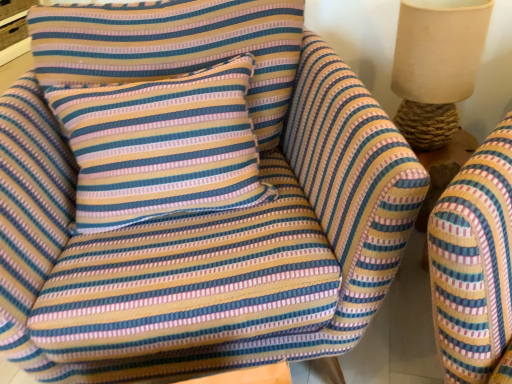
Where is `striped fabric pillow at center`? This screenshot has width=512, height=384. striped fabric pillow at center is located at coordinates (162, 147).

Image resolution: width=512 pixels, height=384 pixels. What do you see at coordinates (162, 147) in the screenshot?
I see `striped fabric pillow at center` at bounding box center [162, 147].

What do you see at coordinates (436, 66) in the screenshot?
I see `burlap lampshade at upper right` at bounding box center [436, 66].

Where is `burlap lampshade at upper right`? The width and height of the screenshot is (512, 384). burlap lampshade at upper right is located at coordinates (436, 66).

At what (x,y) coordinates should I click in order to perform the action: click on striped fabric pillow at center. Please return your answer as a coordinate pair (x, y). The image size is (512, 384). Looking at the image, I should click on (162, 147).

Looking at this image, in the image, is striped fabric pillow at center on the left side or the right side of burlap lampshade at upper right?

striped fabric pillow at center is positioned on burlap lampshade at upper right's left side.

Is the depth of striped fabric pillow at center greater than that of burlap lampshade at upper right?

No, it is not.

Is point (234, 92) less distant than point (408, 56)?

That is True.

From the image's perspective, is striped fabric pillow at center located beneath burlap lampshade at upper right?

Correct, striped fabric pillow at center appears lower than burlap lampshade at upper right in the image.

From a real-world perspective, who is located higher, striped fabric pillow at center or burlap lampshade at upper right?

In real-world perspective, burlap lampshade at upper right is above.

Between striped fabric pillow at center and burlap lampshade at upper right, which one has smaller width?

With smaller width is burlap lampshade at upper right.

Is striped fabric pillow at center taller than burlap lampshade at upper right?

Yes.

From the picture: Which of these two, striped fabric pillow at center or burlap lampshade at upper right, is bigger?

Bigger between the two is striped fabric pillow at center.

Which is correct: striped fabric pillow at center is inside burlap lampshade at upper right, or outside of it?

striped fabric pillow at center lies outside burlap lampshade at upper right.

In the scene shown: Are striped fabric pillow at center and burlap lampshade at upper right located far from each other?

striped fabric pillow at center is near burlap lampshade at upper right, not far away.

From the picture: Could you tell me if striped fabric pillow at center is turned towards burlap lampshade at upper right?

No, striped fabric pillow at center is not turned towards burlap lampshade at upper right.

Looking at this image, what's the angular difference between striped fabric pillow at center and burlap lampshade at upper right's facing directions?

19 degrees.

Where is `table lamp behind the striped fabric pillow at center`? table lamp behind the striped fabric pillow at center is located at coordinates (436, 66).

Is burlap lampshade at upper right to the right of striped fabric pillow at center from the viewer's perspective?

Yes, burlap lampshade at upper right is to the right of striped fabric pillow at center.

Which object is further away from the camera taking this photo, burlap lampshade at upper right or striped fabric pillow at center?

burlap lampshade at upper right.

Considering the points (453, 133) and (69, 96), which point is behind, point (453, 133) or point (69, 96)?

The point (453, 133) is farther.

From the image's perspective, which is above, burlap lampshade at upper right or striped fabric pillow at center?

From the image's view, burlap lampshade at upper right is above.

From a real-world perspective, is burlap lampshade at upper right over striped fabric pillow at center?

Yes, from a real-world perspective, burlap lampshade at upper right is above striped fabric pillow at center.

Does burlap lampshade at upper right have a greater width compared to striped fabric pillow at center?

Incorrect, the width of burlap lampshade at upper right does not surpass that of striped fabric pillow at center.

Considering the relative sizes of burlap lampshade at upper right and striped fabric pillow at center in the image provided, is burlap lampshade at upper right taller than striped fabric pillow at center?

No.

Is burlap lampshade at upper right smaller than striped fabric pillow at center?

Correct, burlap lampshade at upper right occupies less space than striped fabric pillow at center.

Is striped fabric pillow at center inside burlap lampshade at upper right?

Actually, striped fabric pillow at center is outside burlap lampshade at upper right.

Is burlap lampshade at upper right touching striped fabric pillow at center?

No, burlap lampshade at upper right is not making contact with striped fabric pillow at center.

Is burlap lampshade at upper right facing towards striped fabric pillow at center?

No.

What's the angular difference between burlap lampshade at upper right and striped fabric pillow at center's facing directions?

19 degrees.

Find the location of a particular element. The width and height of the screenshot is (512, 384). pillow in front of the burlap lampshade at upper right is located at coordinates (162, 147).

The width and height of the screenshot is (512, 384). Find the location of `pillow that is under the burlap lampshade at upper right (from a real-world perspective)`. pillow that is under the burlap lampshade at upper right (from a real-world perspective) is located at coordinates (162, 147).

The width and height of the screenshot is (512, 384). In order to click on table lamp behind the striped fabric pillow at center in this screenshot , I will do `click(436, 66)`.